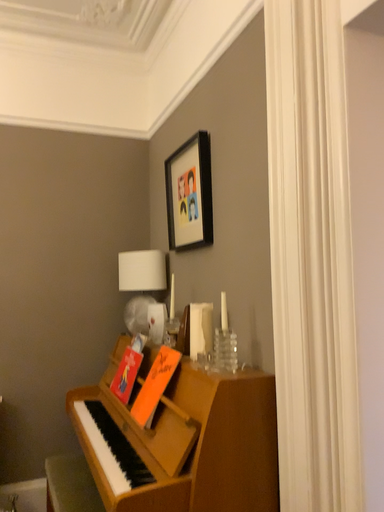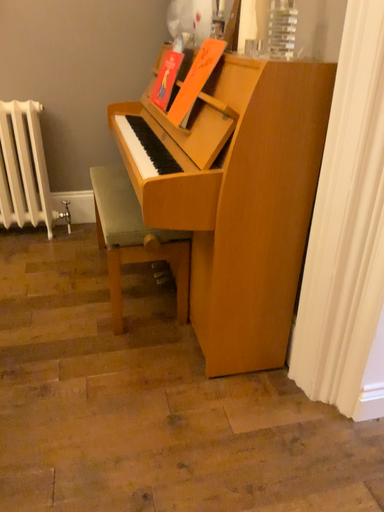
Question: How did the camera likely rotate when shooting the video?

Choices:
 (A) rotated upward
 (B) rotated downward

Answer: (B)